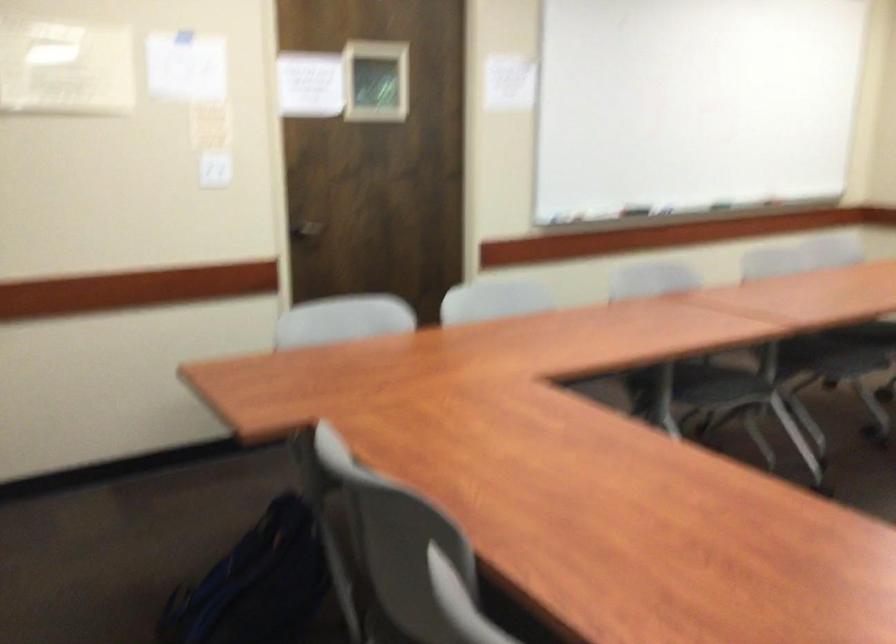
Where is `white light switch`? white light switch is located at coordinates (214, 169).